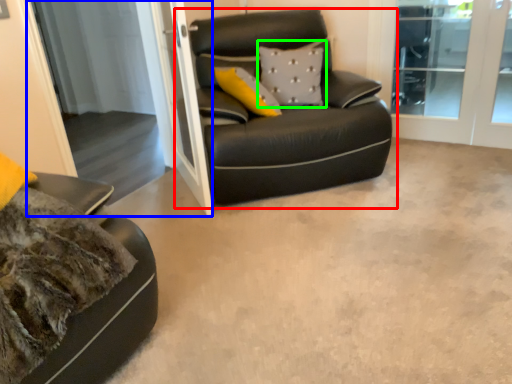
Question: Which object is positioned farthest from studio couch (highlighted by a red box)? Select from screen door (highlighted by a blue box) and pillow (highlighted by a green box).

Choices:
 (A) screen door
 (B) pillow

Answer: (A)